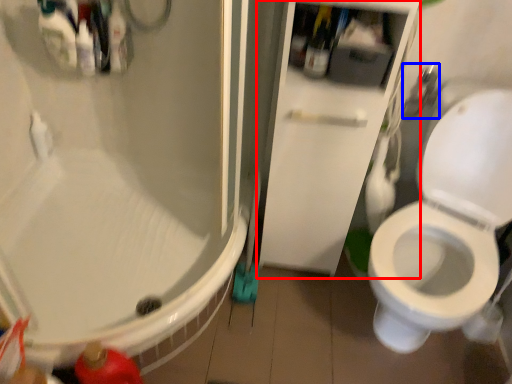
Question: Which point is further to the camera, screen door (highlighted by a red box) or shower (highlighted by a blue box)?

Choices:
 (A) screen door
 (B) shower

Answer: (B)